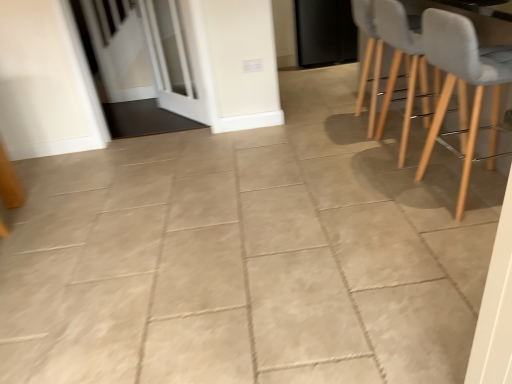
Question: Could light gray fabric chair at right, which appears as the 2th chair when viewed from the back, be considered to be inside light gray fabric chair at upper right?

Choices:
 (A) no
 (B) yes

Answer: (A)

Question: Considering the relative sizes of light gray fabric chair at upper right and light gray fabric chair at right, which appears as the 2th chair when viewed from the back, in the image provided, is light gray fabric chair at upper right wider than light gray fabric chair at right, which appears as the 2th chair when viewed from the back,?

Choices:
 (A) no
 (B) yes

Answer: (A)

Question: From a real-world perspective, is light gray fabric chair at upper right over light gray fabric chair at right, which appears as the 2th chair when viewed from the back?

Choices:
 (A) yes
 (B) no

Answer: (B)

Question: Is light gray fabric chair at upper right positioned before light gray fabric chair at right, which appears as the 2th chair when viewed from the back?

Choices:
 (A) yes
 (B) no

Answer: (B)

Question: From the image's perspective, is light gray fabric chair at upper right beneath light gray fabric chair at right, which appears as the 2th chair when viewed from the back?

Choices:
 (A) yes
 (B) no

Answer: (B)

Question: Is light gray fabric chair at upper right thinner than light gray fabric chair at right, the 1th chair in the front-to-back sequence?

Choices:
 (A) yes
 (B) no

Answer: (A)

Question: Considering the relative sizes of light gray fabric chair at right, marked as the second chair in a front-to-back arrangement, and light gray fabric chair at upper right in the image provided, is light gray fabric chair at right, marked as the second chair in a front-to-back arrangement, thinner than light gray fabric chair at upper right?

Choices:
 (A) yes
 (B) no

Answer: (B)

Question: Are light gray fabric chair at right, marked as the second chair in a front-to-back arrangement, and light gray fabric chair at upper right beside each other?

Choices:
 (A) no
 (B) yes

Answer: (A)

Question: Considering the relative positions of light gray fabric chair at right, which is the 1th chair in back-to-front order, and light gray fabric chair at upper right in the image provided, is light gray fabric chair at right, which is the 1th chair in back-to-front order, to the left of light gray fabric chair at upper right from the viewer's perspective?

Choices:
 (A) no
 (B) yes

Answer: (B)

Question: From a real-world perspective, is light gray fabric chair at right, which is the 1th chair in back-to-front order, located higher than light gray fabric chair at upper right?

Choices:
 (A) no
 (B) yes

Answer: (A)

Question: Considering the relative positions of light gray fabric chair at right, which is the 1th chair in back-to-front order, and light gray fabric chair at upper right in the image provided, is light gray fabric chair at right, which is the 1th chair in back-to-front order, to the right of light gray fabric chair at upper right from the viewer's perspective?

Choices:
 (A) no
 (B) yes

Answer: (A)

Question: Is light gray fabric chair at right, which is the 1th chair in back-to-front order, positioned before light gray fabric chair at upper right?

Choices:
 (A) yes
 (B) no

Answer: (B)

Question: From a real-world perspective, is white glass screen door at upper left, which appears as the 2th screen door when viewed from the back, beneath black matte door at upper center?

Choices:
 (A) yes
 (B) no

Answer: (B)